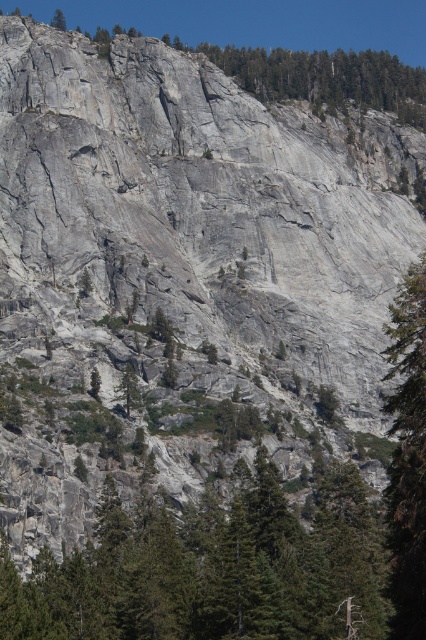
You are a hiker trying to navigate between the green textured tree at right and the green textured tree at upper left. Which tree should you aim for if you want to reach a larger tree first?

The green textured tree at upper left is larger than the green textured tree at right, so you should aim for the green textured tree at upper left to reach a larger tree first.

You are a hiker planning to climb the mountain. You have two reference points marked on your map as point 1 at coordinates (425,614) and point 2 at coordinates (52,26). Which point is closer to the base of the mountain where you will start your climb?

Point 1 at coordinates (425,614) is closer to the base of the mountain because it is in front of point 2 at coordinates (52,26), which is further away from the starting point.